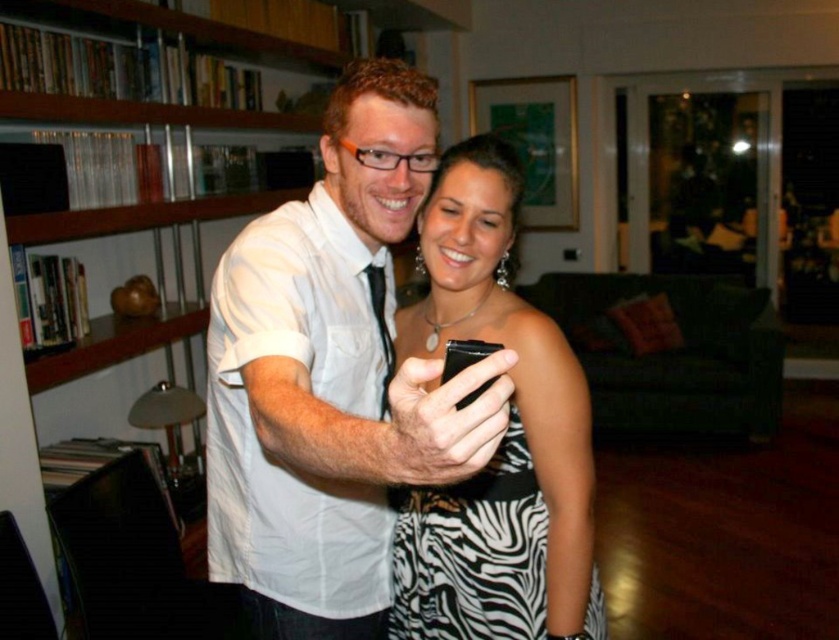
You are a photographer setting up a photo shoot in this scene. You need to ensure that the white matte shirt at center and the zebra print dress at center are visible in the frame. Given their sizes, which clothing item should you focus on to make sure it fits within the camera frame?

The white matte shirt at center is wider than the zebra print dress at center, so you should focus on ensuring the white matte shirt at center fits within the frame first since it requires more space.

You are a photographer trying to adjust the focus of your camera. You have two points in the image to focus on, point (374, 502) and point (470, 541). Which point is closer to the camera and should be in focus?

Point (374, 502) is further to the camera than point (470, 541), so the point closer to the camera is point (470, 541) and should be in focus.